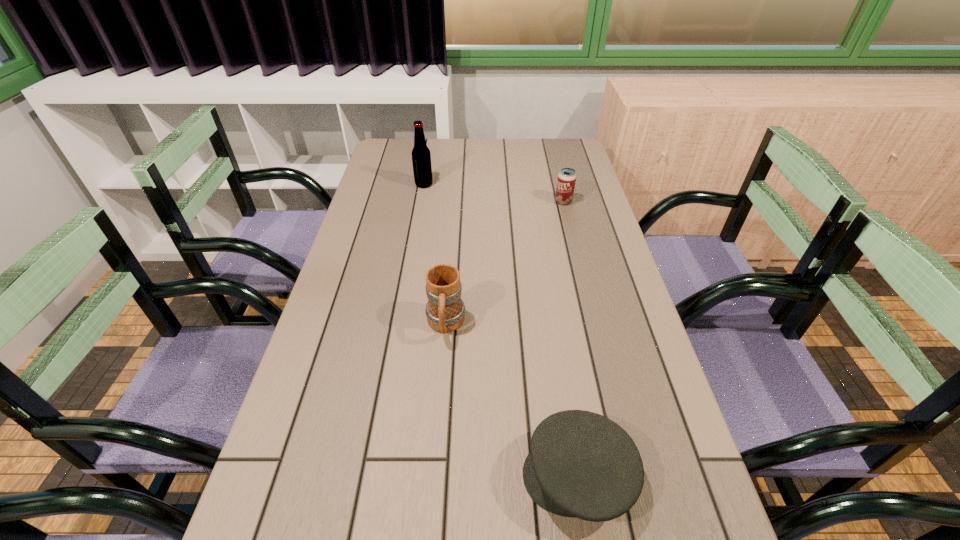
This screenshot has height=540, width=960. What are the coordinates of `vacant space located 0.130m on the left of the third tallest object` in the screenshot? It's located at (516, 201).

Locate an element on the screen. The width and height of the screenshot is (960, 540). vacant point located 0.310m on the front-facing side of the beret is located at coordinates (355, 476).

You are a GUI agent. You are given a task and a screenshot of the screen. Output one action in this format:
    pyautogui.click(x=<x>, y=<y>)
    Task: Click on the vacant space located on the front-facing side of the beret
    
    Given the screenshot: What is the action you would take?
    pyautogui.click(x=311, y=476)

Where is `free location located on the front-facing side of the beret`? free location located on the front-facing side of the beret is located at coordinates 344,476.

This screenshot has width=960, height=540. I want to click on beer can that is positioned at the right edge, so click(x=566, y=180).

Find the location of `beret that is at the right edge`. beret that is at the right edge is located at coordinates (581, 464).

The width and height of the screenshot is (960, 540). I want to click on vacant space at the left edge of the desktop, so click(x=340, y=373).

Find the location of a particular element. This screenshot has height=540, width=960. blank space at the right edge of the desktop is located at coordinates (561, 221).

The height and width of the screenshot is (540, 960). In order to click on free space at the far left corner of the desktop in this screenshot , I will do `click(412, 142)`.

In the image, there is a desktop. Identify the location of vacant space at the far right corner. (568, 144).